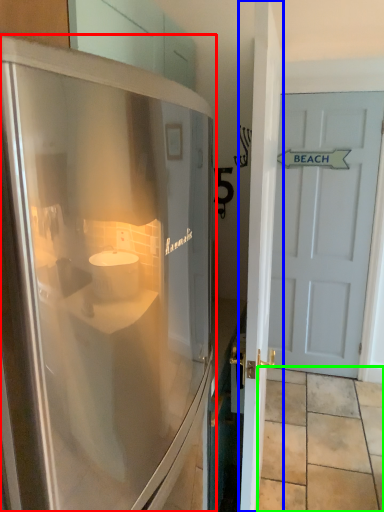
Question: Considering the real-world distances, which object is farthest from refrigerator (highlighted by a red box)? door (highlighted by a blue box) or tile (highlighted by a green box)?

Choices:
 (A) door
 (B) tile

Answer: (B)